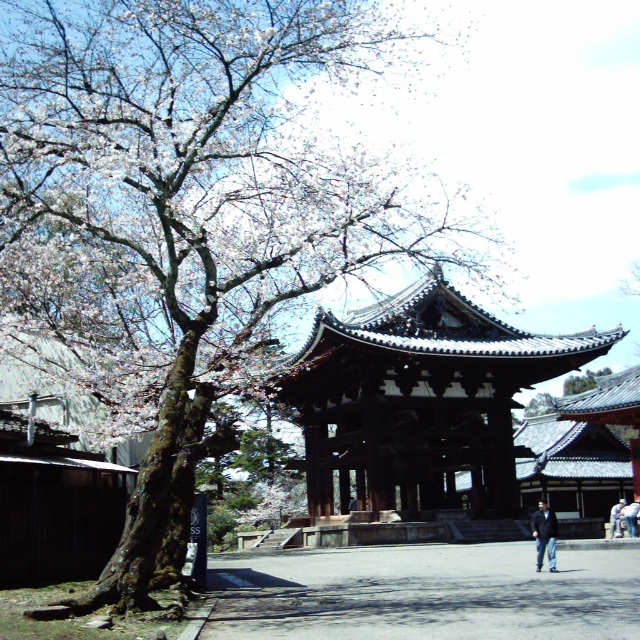
Question: Is light blue denim jeans at lower right thinner than denim pants at lower right?

Choices:
 (A) no
 (B) yes

Answer: (A)

Question: Based on their relative distances, which object is farther from the dark brown wooden gate at center?

Choices:
 (A) light blue denim jeans at lower right
 (B) dark blue jeans at lower right

Answer: (A)

Question: Estimate the real-world distances between objects in this image. Which object is closer to the dark blue jeans at lower right?

Choices:
 (A) light blue denim jeans at lower right
 (B) denim pants at lower right
 (C) dark brown wooden gate at center

Answer: (B)

Question: Can you confirm if dark blue jeans at lower right is positioned below denim pants at lower right?

Choices:
 (A) no
 (B) yes

Answer: (B)

Question: Which is farther from the light blue denim jeans at lower right?

Choices:
 (A) dark blue jeans at lower right
 (B) dark brown wooden gate at center

Answer: (B)

Question: Is dark brown wooden gate at center positioned at the back of denim pants at lower right?

Choices:
 (A) no
 (B) yes

Answer: (B)